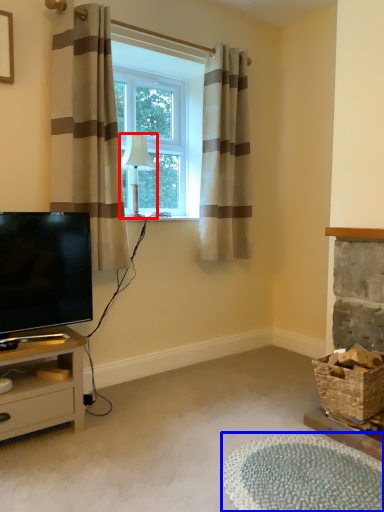
Question: Which object is further to the camera taking this photo, lamp (highlighted by a red box) or plain (highlighted by a blue box)?

Choices:
 (A) lamp
 (B) plain

Answer: (A)